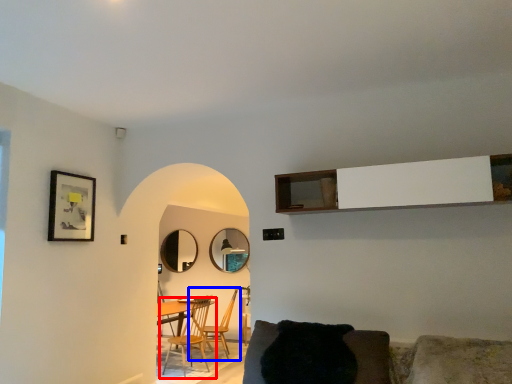
Question: Which point is further to the camera, chair (highlighted by a red box) or chair (highlighted by a blue box)?

Choices:
 (A) chair
 (B) chair

Answer: (B)